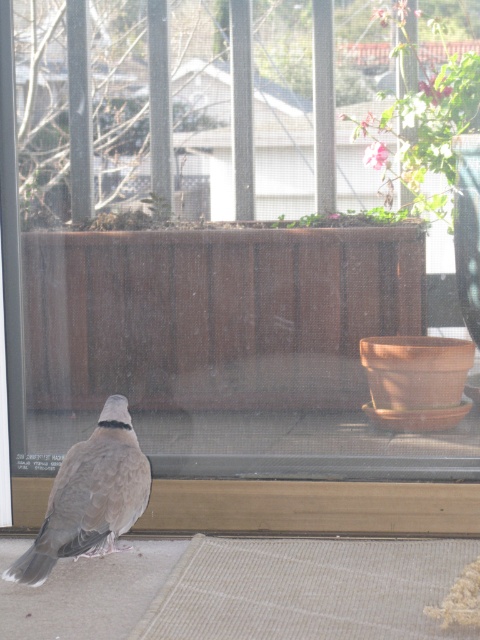
Does gray matte bird at lower left have a lesser width compared to clear plastic screen door at left?

Incorrect, gray matte bird at lower left's width is not less than clear plastic screen door at left's.

What do you see at coordinates (91, 497) in the screenshot? I see `gray matte bird at lower left` at bounding box center [91, 497].

Where is `gray matte bird at lower left`? The height and width of the screenshot is (640, 480). gray matte bird at lower left is located at coordinates (91, 497).